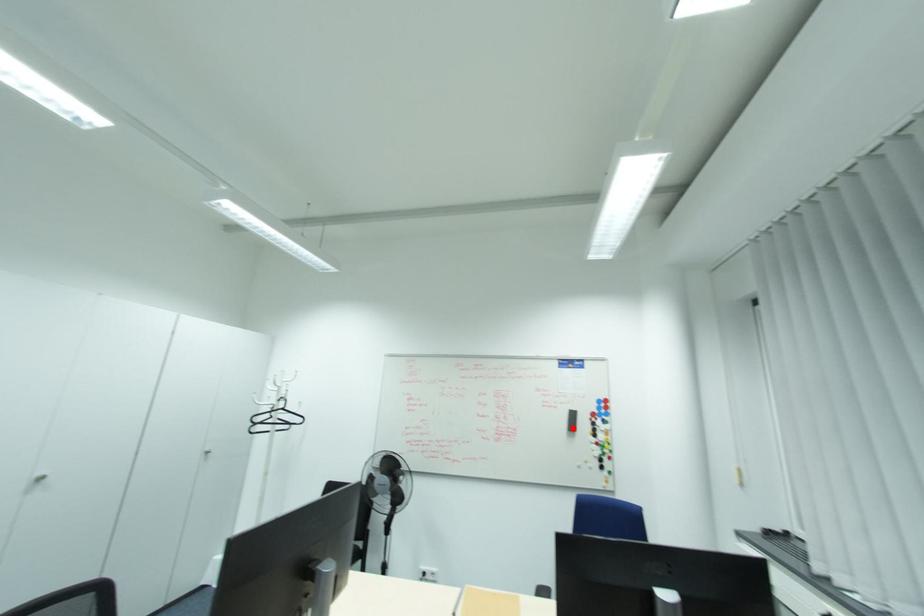
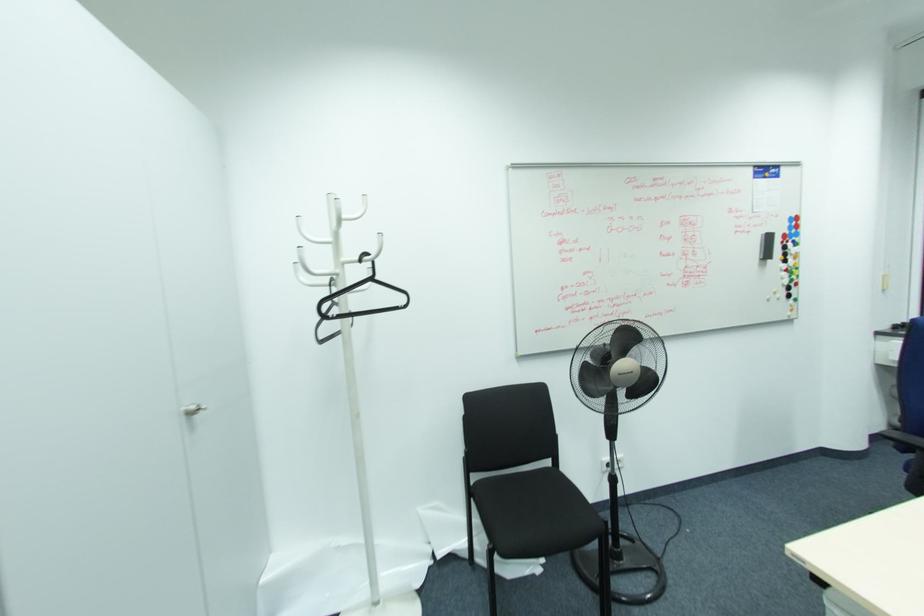
Find the pixel in the second image that matches the highlighted location in the first image.

(768, 256)